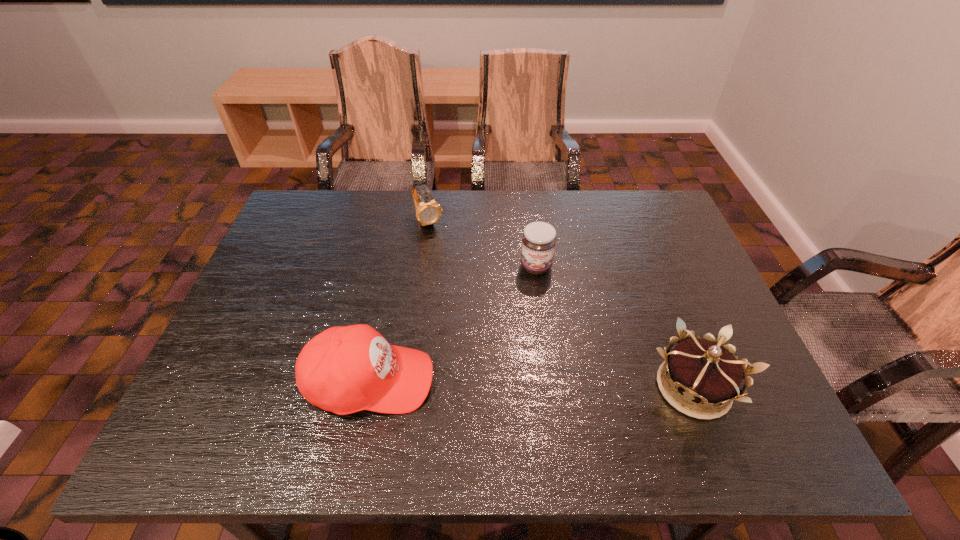
The width and height of the screenshot is (960, 540). In order to click on baseball cap in this screenshot , I will do `click(346, 369)`.

You are a GUI agent. You are given a task and a screenshot of the screen. Output one action in this format:
    pyautogui.click(x=<x>, y=<y>)
    Task: Click on the rightmost object
    This screenshot has width=960, height=540.
    Given the screenshot: What is the action you would take?
    pyautogui.click(x=704, y=371)

Where is `the third nearest object`? the third nearest object is located at coordinates pos(539,239).

Image resolution: width=960 pixels, height=540 pixels. I want to click on jam, so click(x=539, y=239).

The image size is (960, 540). Identify the location of the farthest object. (428, 212).

Where is `free region located 0.350m on the front panel of the baseball cap`? The image size is (960, 540). free region located 0.350m on the front panel of the baseball cap is located at coordinates (593, 381).

The height and width of the screenshot is (540, 960). In order to click on vacant space located on the left of the crown in this screenshot , I will do `click(584, 387)`.

Image resolution: width=960 pixels, height=540 pixels. In order to click on free space located on the front label of the third nearest object in this screenshot , I will do `click(540, 325)`.

Locate an element on the screen. free space located on the front label of the third nearest object is located at coordinates (541, 352).

In order to click on free space located on the front label of the third nearest object in this screenshot , I will do `click(543, 394)`.